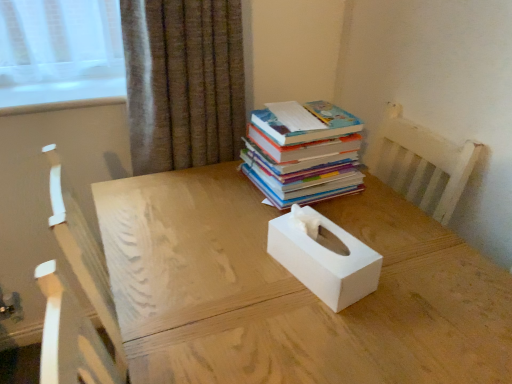
Question: Looking at the image, does hardcover books at upper right seem bigger or smaller compared to brown textured curtain at upper center?

Choices:
 (A) small
 (B) big

Answer: (A)

Question: Would you say hardcover books at upper right is inside or outside brown textured curtain at upper center?

Choices:
 (A) outside
 (B) inside

Answer: (A)

Question: Which of these objects is positioned closest to the hardcover books at upper right?

Choices:
 (A) white matte tissue box at center
 (B) brown textured curtain at upper center
 (C) white matte tissue box at center

Answer: (C)

Question: Which is nearer to the white matte tissue box at center?

Choices:
 (A) hardcover books at upper right
 (B) brown textured curtain at upper center
 (C) white matte tissue box at center

Answer: (C)